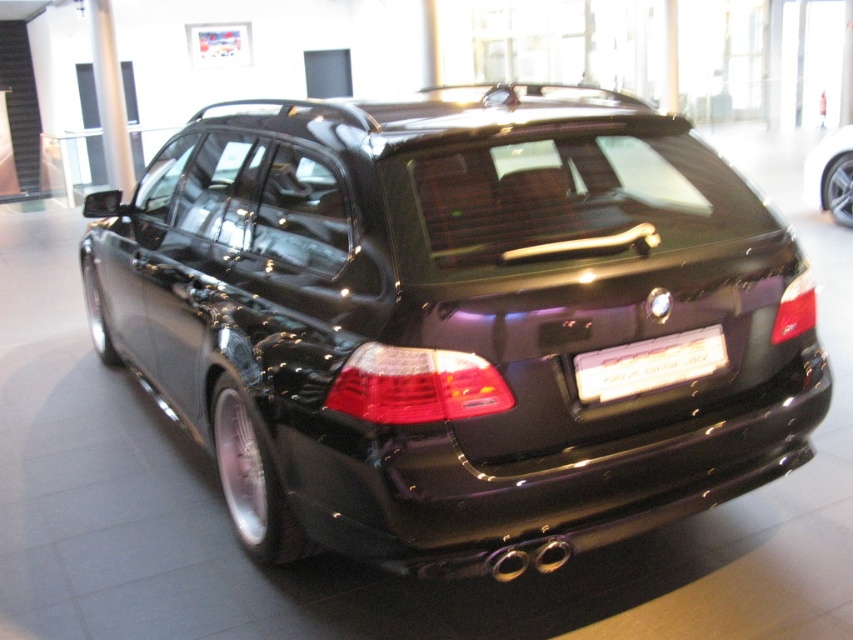
Is point (526, 93) positioned in front of point (608, 372)?

No.

Is shiny black car at center taller than white plastic license plate at center?

Indeed, shiny black car at center has a greater height compared to white plastic license plate at center.

Who is more forward, (628, 426) or (712, 342)?

Point (628, 426) is more forward.

Where is `shiny black car at center`? The image size is (853, 640). shiny black car at center is located at coordinates (453, 323).

Can you confirm if shiny black car at center is taller than glossy black car at center?

Indeed, shiny black car at center has a greater height compared to glossy black car at center.

Is shiny black car at center further to the viewer compared to glossy black car at center?

No, shiny black car at center is in front of glossy black car at center.

Who is more distant from viewer, (251, 531) or (805, 160)?

Positioned behind is point (805, 160).

At what (x,y) coordinates should I click in order to perform the action: click on shiny black car at center. Please return your answer as a coordinate pair (x, y). The image size is (853, 640). Looking at the image, I should click on (453, 323).

Does white plastic license plate at center have a larger size compared to glossy black car at center?

Correct, white plastic license plate at center is larger in size than glossy black car at center.

Locate an element on the screen. The width and height of the screenshot is (853, 640). white plastic license plate at center is located at coordinates click(x=648, y=364).